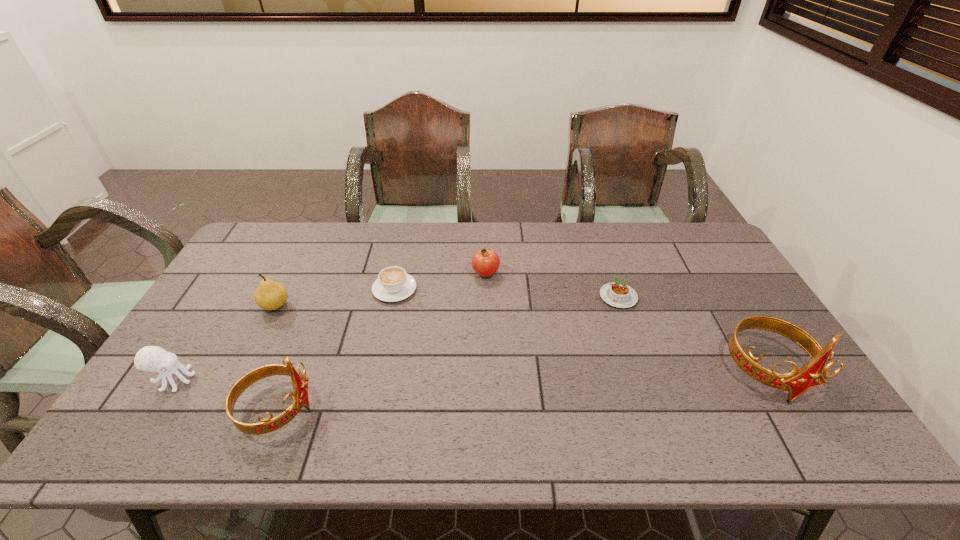
Where is `octopus`? octopus is located at coordinates (149, 358).

Find the location of a particular element. The image size is (960, 540). vacant space located on the front-facing side of the shorter tiara is located at coordinates (483, 409).

What are the coordinates of `free point located 0.090m on the front of the shortest object` in the screenshot? It's located at (631, 333).

Identify the location of blank space located 0.060m on the side of the fourth object from right to left with the handle. This screenshot has width=960, height=540. (400, 264).

Where is `vacant region located on the side of the fourth object from right to left with the handle`? The width and height of the screenshot is (960, 540). vacant region located on the side of the fourth object from right to left with the handle is located at coordinates (407, 232).

Where is `vacant point located on the side of the fourth object from right to left with the handle`? vacant point located on the side of the fourth object from right to left with the handle is located at coordinates tap(400, 261).

This screenshot has width=960, height=540. I want to click on vacant region located 0.070m on the front of the pear, so click(x=261, y=334).

The width and height of the screenshot is (960, 540). What are the coordinates of `free space located 0.120m on the front of the fifth object from left to right` in the screenshot? It's located at (486, 309).

Where is `free region located 0.290m on the front-facing side of the leftmost object`? free region located 0.290m on the front-facing side of the leftmost object is located at coordinates (307, 380).

This screenshot has height=540, width=960. I want to click on octopus present at the near edge, so click(149, 358).